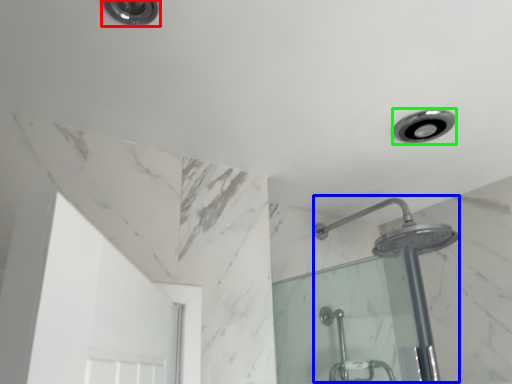
Question: Based on their relative distances, which object is farther from light fixture (highlighted by a red box)? Choose from shower (highlighted by a blue box) and light fixture (highlighted by a green box).

Choices:
 (A) shower
 (B) light fixture

Answer: (A)